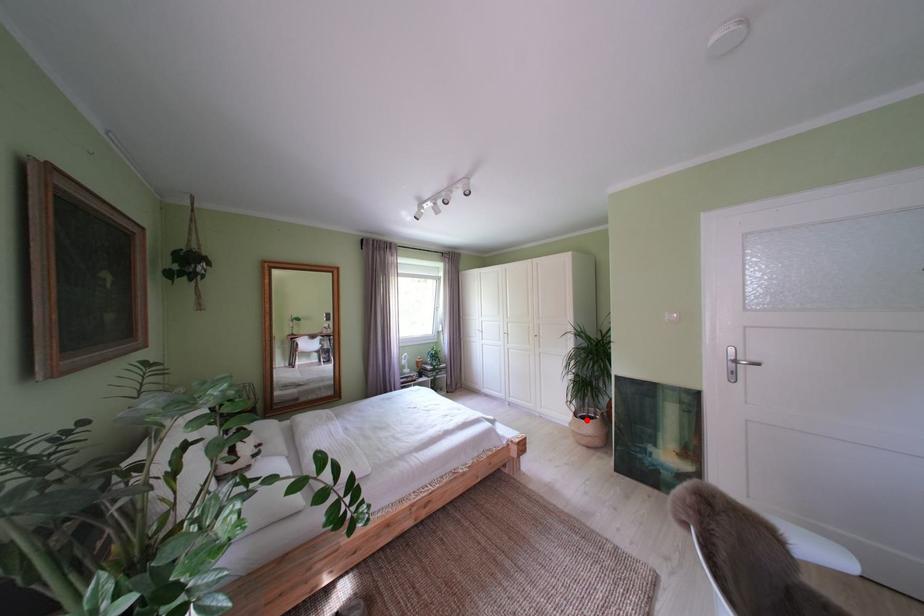
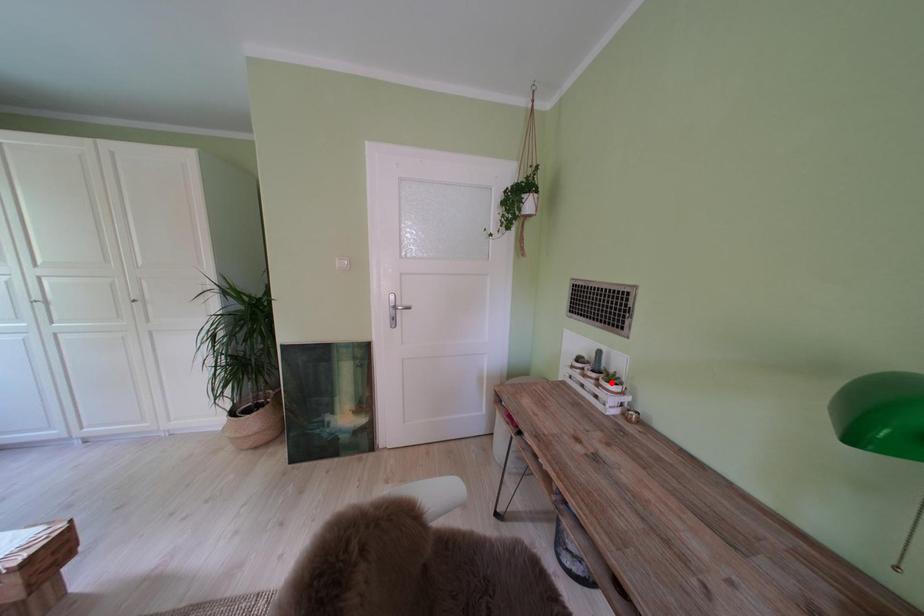
I am providing you with two images of the same scene from different viewpoints. A red point is marked on the first image and another point is marked on the second image. Do the highlighted points in image1 and image2 indicate the same real-world spot?

No